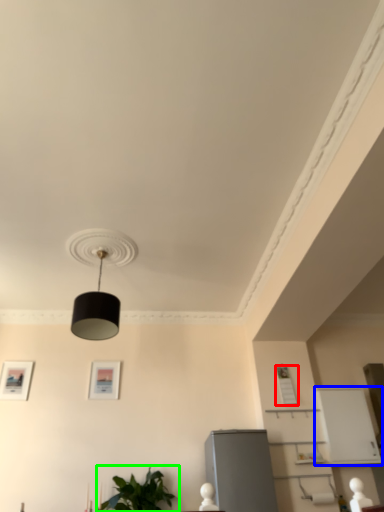
Question: Which object is positioned farthest from picture frame (highlighted by a red box)? Select from shelf (highlighted by a blue box) and houseplant (highlighted by a green box).

Choices:
 (A) shelf
 (B) houseplant

Answer: (B)